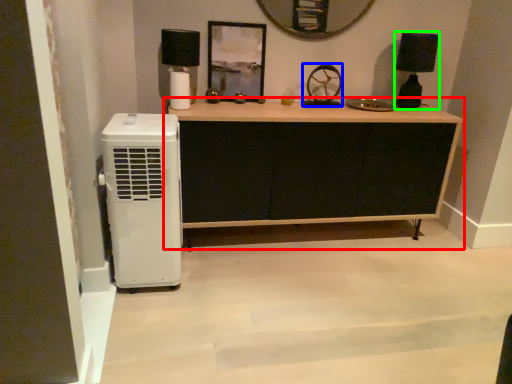
Question: Considering the real-world distances, which object is farthest from chest of drawers (highlighted by a red box)? wheel (highlighted by a blue box) or lamp (highlighted by a green box)?

Choices:
 (A) wheel
 (B) lamp

Answer: (B)